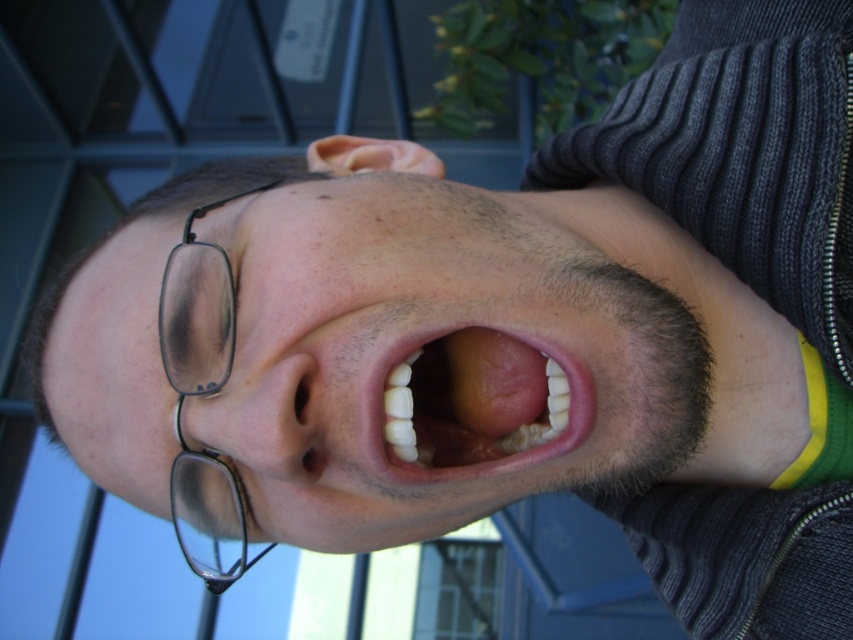
Is smooth skin face at center below black plastic glasses at left?

Actually, smooth skin face at center is above black plastic glasses at left.

Does point (131, 346) lie in front of point (184, 292)?

No, it is not.

The width and height of the screenshot is (853, 640). Identify the location of smooth skin face at center. (376, 356).

The width and height of the screenshot is (853, 640). Describe the element at coordinates (376, 356) in the screenshot. I see `smooth skin face at center` at that location.

Between smooth skin face at center and white glossy teeth at center, which one appears on the right side from the viewer's perspective?

Positioned to the right is white glossy teeth at center.

This screenshot has height=640, width=853. I want to click on smooth skin face at center, so click(376, 356).

The width and height of the screenshot is (853, 640). What do you see at coordinates (473, 400) in the screenshot?
I see `white glossy teeth at center` at bounding box center [473, 400].

Who is taller, white glossy teeth at center or black plastic glasses at left?

Standing taller between the two is black plastic glasses at left.

Between point (474, 344) and point (183, 390), which one is positioned behind?

The point (474, 344) is behind.

At what (x,y) coordinates should I click in order to perform the action: click on white glossy teeth at center. Please return your answer as a coordinate pair (x, y). The image size is (853, 640). Looking at the image, I should click on (473, 400).